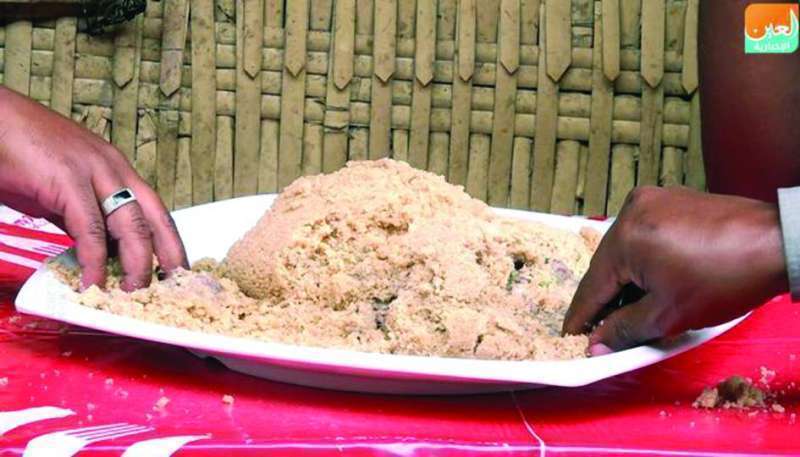
This screenshot has height=457, width=800. I want to click on red table, so click(333, 412).